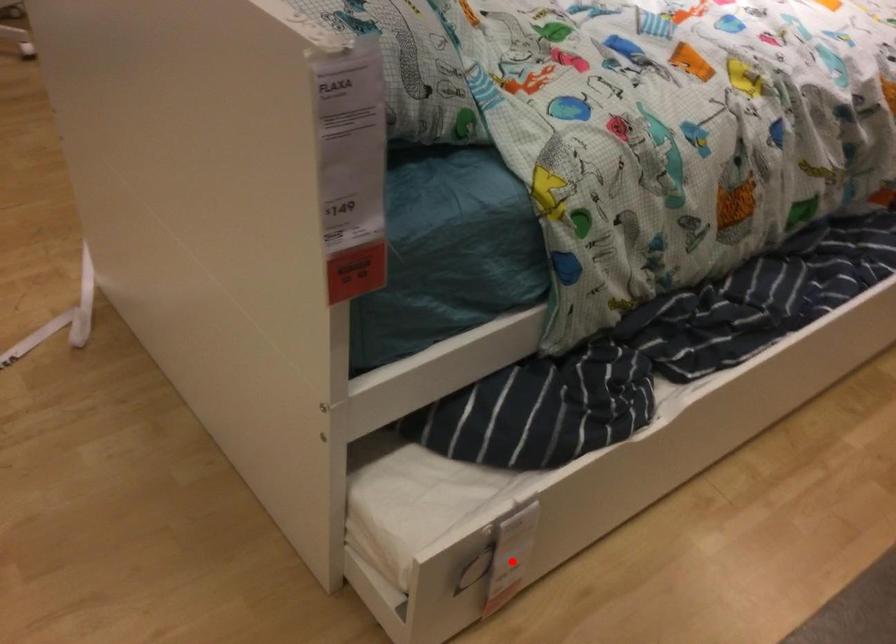
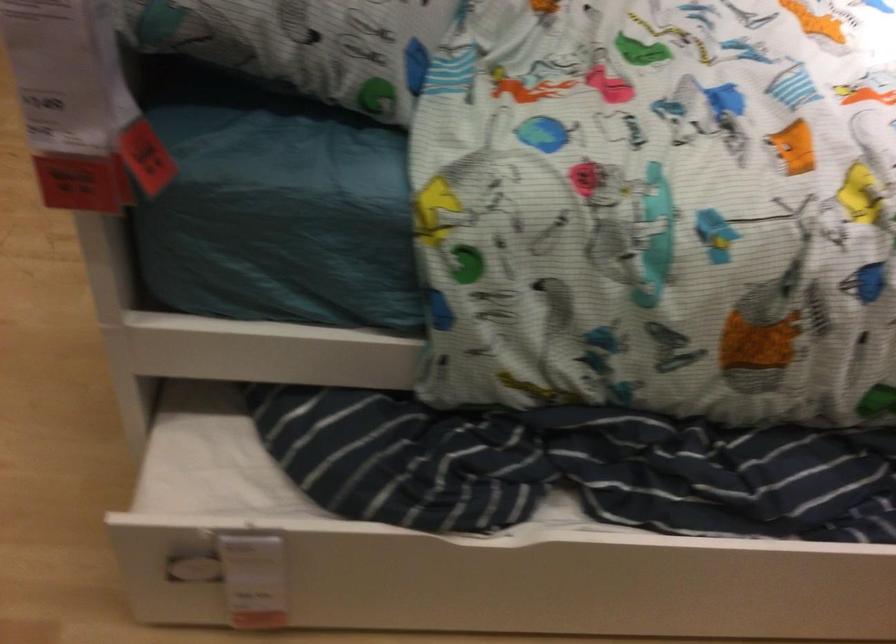
Question: I am providing you with two images of the same scene from different viewpoints. Image1 has a red point marked. In image2, the corresponding 3D location appears at what relative position? Reply with the corresponding letter.

Choices:
 (A) Closer
 (B) Farther

Answer: (A)